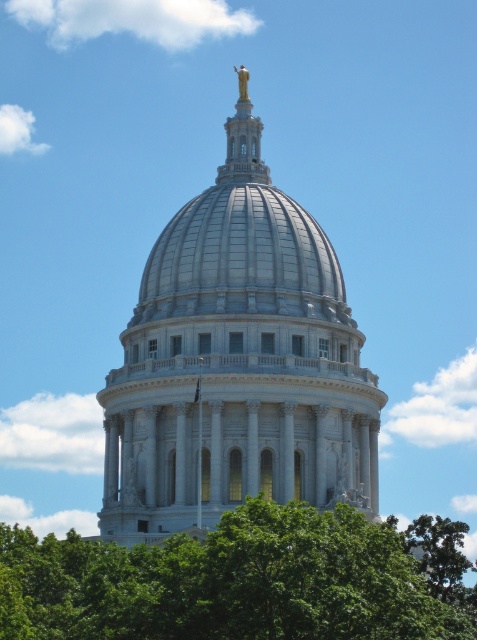
You are an architect analyzing the dome of the Wisconsin State Capitol. You observe two points marked on the dome structure at coordinates point (124, 461) and point (422, 598). From your vantage point, which point is closer to you?

Point (422, 598) is closer to you because point (124, 461) is behind it.

You are standing in a park across from the Wisconsin State Capitol building. You want to take a photo of the white marble dome at center. If your camera can capture objects up to 100 meters away, will you be able to capture the entire dome in your photo?

The white marble dome at center is 76.60 meters from viewer, which is within the camera range of up to 100 meters. Therefore, you can capture the entire dome in your photo.